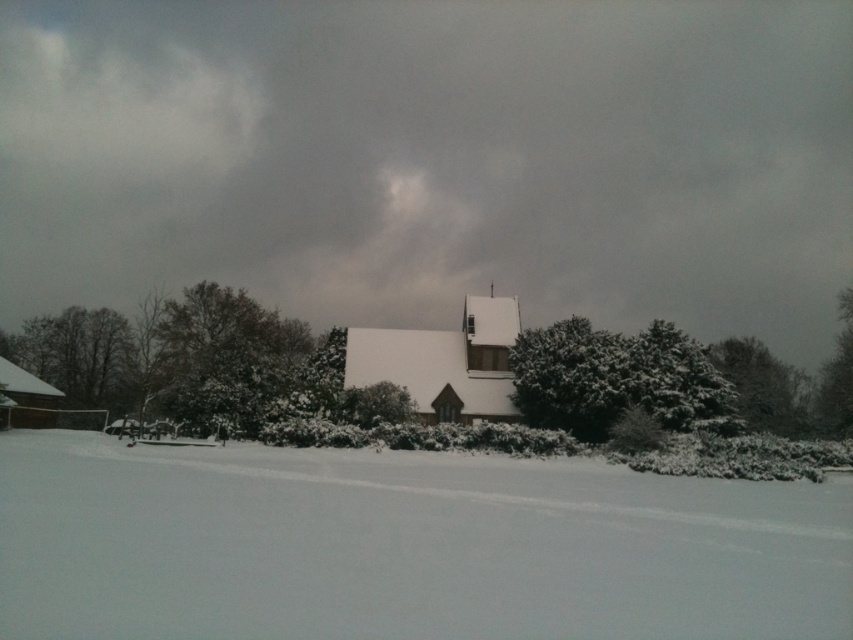
Is cloudy gray sky at upper center thinner than snowy evergreen tree at right?

No, cloudy gray sky at upper center is not thinner than snowy evergreen tree at right.

At what (x,y) coordinates should I click in order to perform the action: click on cloudy gray sky at upper center. Please return your answer as a coordinate pair (x, y). The width and height of the screenshot is (853, 640). Looking at the image, I should click on (434, 157).

Does point (422, 182) lie behind point (749, 406)?

That is True.

The width and height of the screenshot is (853, 640). I want to click on cloudy gray sky at upper center, so click(434, 157).

Does green leafy tree at left appear on the right side of snowy evergreen tree at right?

In fact, green leafy tree at left is to the left of snowy evergreen tree at right.

Can you confirm if green leafy tree at left is taller than snowy evergreen tree at right?

Indeed, green leafy tree at left has a greater height compared to snowy evergreen tree at right.

Who is more distant from viewer, (38, 326) or (769, 364)?

Point (38, 326)

Identify the location of green leafy tree at left. (78, 355).

Does cloudy gray sky at upper center have a lesser height compared to white wooden church at center?

Incorrect, cloudy gray sky at upper center's height does not fall short of white wooden church at center's.

Between cloudy gray sky at upper center and white wooden church at center, which one appears on the left side from the viewer's perspective?

cloudy gray sky at upper center

Who is more forward, (695, 113) or (373, 365)?

Point (373, 365) is more forward.

Find the location of a particular element. Image resolution: width=853 pixels, height=640 pixels. cloudy gray sky at upper center is located at coordinates (434, 157).